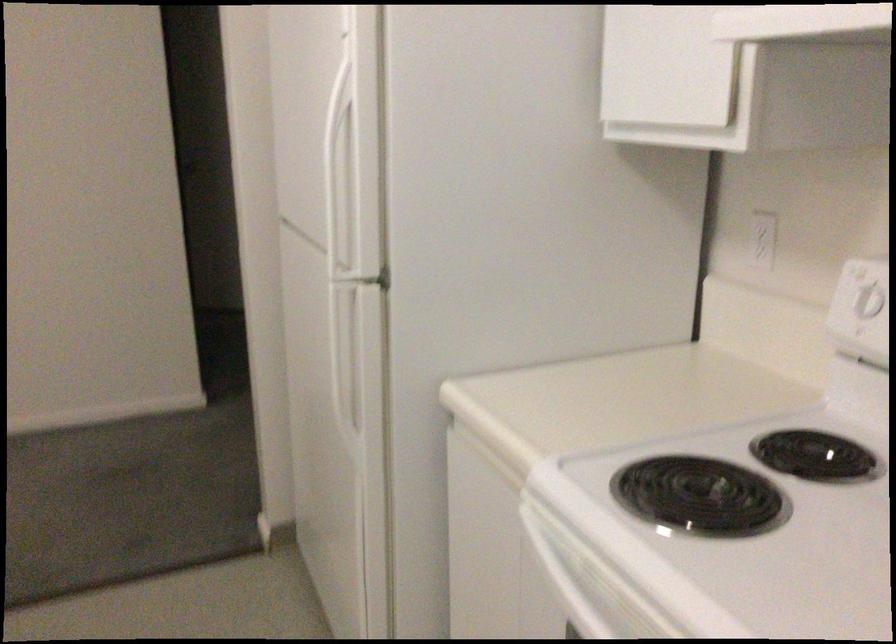
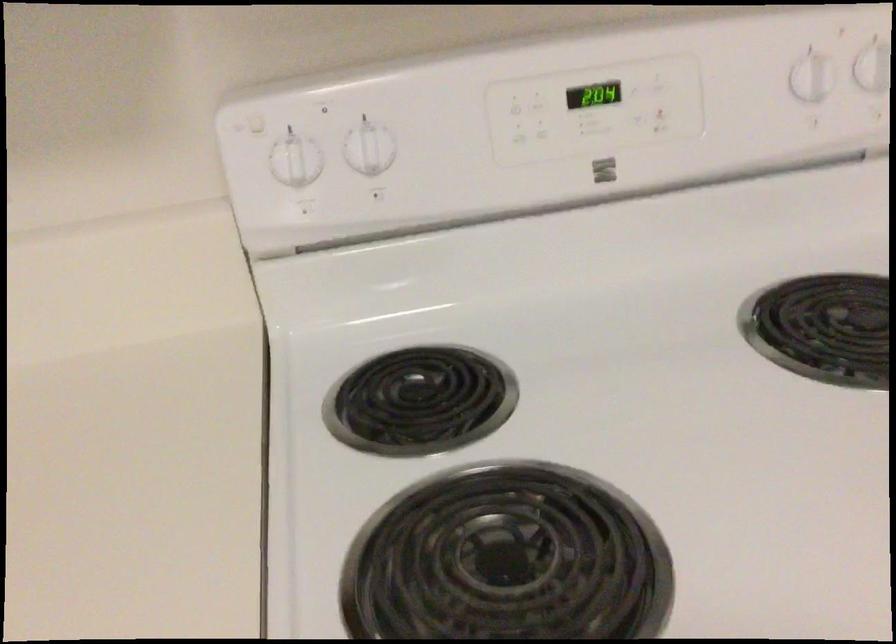
How did the camera likely rotate?

The camera's rotation is toward right-down.